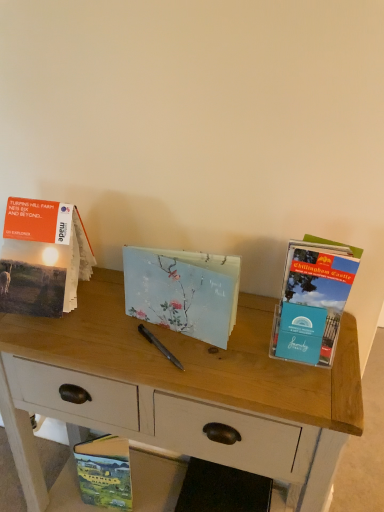
Where is `vacant region in front of blue cardstock brochure at right, which is the 2th book from bottom to top`? vacant region in front of blue cardstock brochure at right, which is the 2th book from bottom to top is located at coordinates (310, 390).